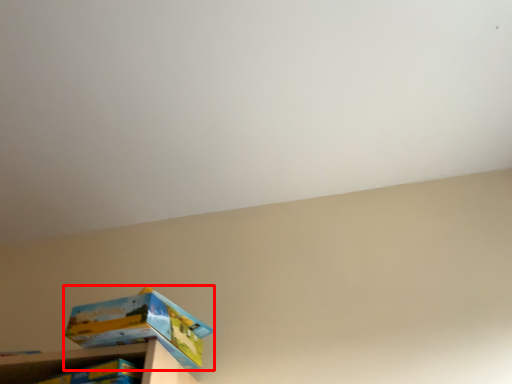
Question: From the image's perspective, considering the relative positions of box (annotated by the red box) and shelf in the image provided, where is box (annotated by the red box) located with respect to the staircase?

Choices:
 (A) below
 (B) above

Answer: (B)